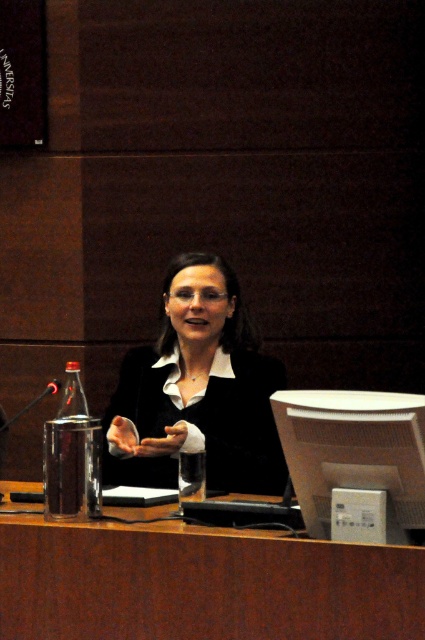
Is brown wood table at center below black glossy suit at center?

Indeed, brown wood table at center is positioned under black glossy suit at center.

Which is above, brown wood table at center or black glossy suit at center?

black glossy suit at center is above.

The image size is (425, 640). Identify the location of brown wood table at center. (201, 582).